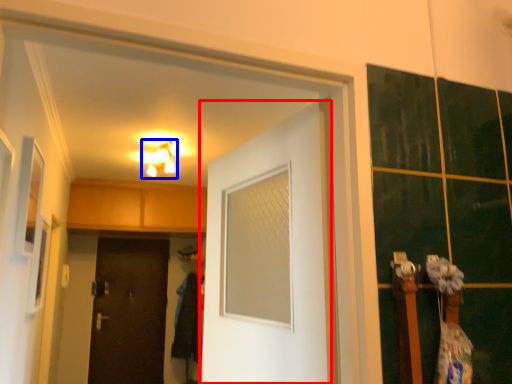
Question: Which point is further to the camera, door (highlighted by a red box) or light fixture (highlighted by a blue box)?

Choices:
 (A) door
 (B) light fixture

Answer: (B)